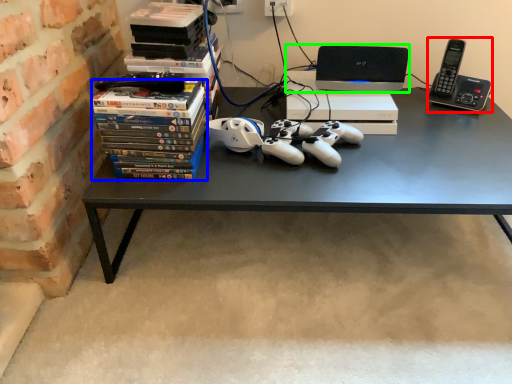
Question: Based on their relative distances, which object is farther from gadget (highlighted by a red box)? Choose from book (highlighted by a blue box) and computer (highlighted by a green box).

Choices:
 (A) book
 (B) computer

Answer: (A)